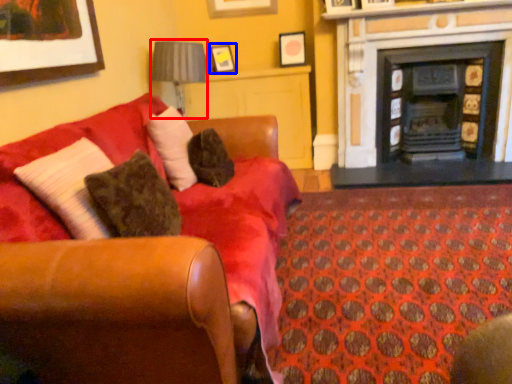
Question: Which of the following is the farthest to the observer, lamp (highlighted by a red box) or picture frame (highlighted by a blue box)?

Choices:
 (A) lamp
 (B) picture frame

Answer: (B)